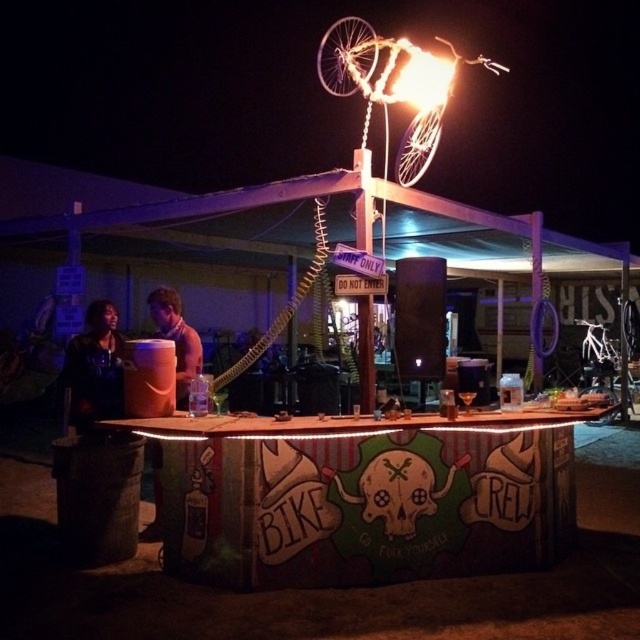
Looking at this image, which is more to the left, wooden barrel at center or white matte bicycle at center-right?

From the viewer's perspective, wooden barrel at center appears more on the left side.

Is wooden barrel at center behind white matte bicycle at center-right?

No.

Which is in front, point (177, 392) or point (596, 349)?

Positioned in front is point (177, 392).

This screenshot has width=640, height=640. Identify the location of wooden barrel at center. (177, 339).

Looking at this image, is velvet black jacket at lower left smaller than wooden barrel at center?

No.

Which of these two, velvet black jacket at lower left or wooden barrel at center, stands taller?

velvet black jacket at lower left is taller.

Locate an element on the screen. The width and height of the screenshot is (640, 640). velvet black jacket at lower left is located at coordinates (93, 369).

Consider the image. Between velvet black jacket at lower left and white matte bicycle at center-right, which one has less height?

With less height is velvet black jacket at lower left.

Who is taller, velvet black jacket at lower left or white matte bicycle at center-right?

white matte bicycle at center-right is taller.

Where is `velvet black jacket at lower left`? velvet black jacket at lower left is located at coordinates (93, 369).

Find the location of a particular element. velvet black jacket at lower left is located at coordinates pos(93,369).